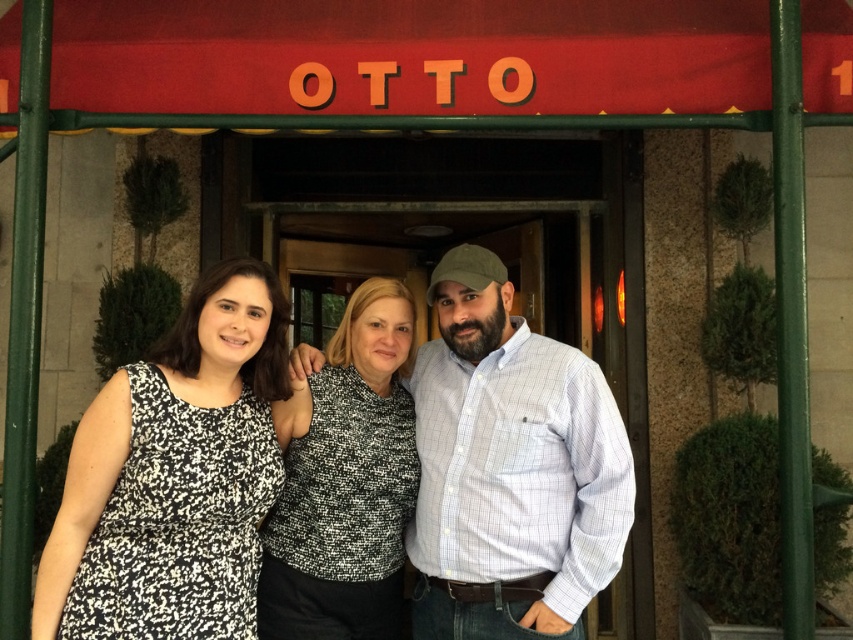
You are a photographer trying to adjust the lighting for a group photo. You notice the black printed dress at left and the speckled fabric blouse at center. Which clothing item is shorter in height?

The black printed dress at left is shorter in height compared to the speckled fabric blouse at center.